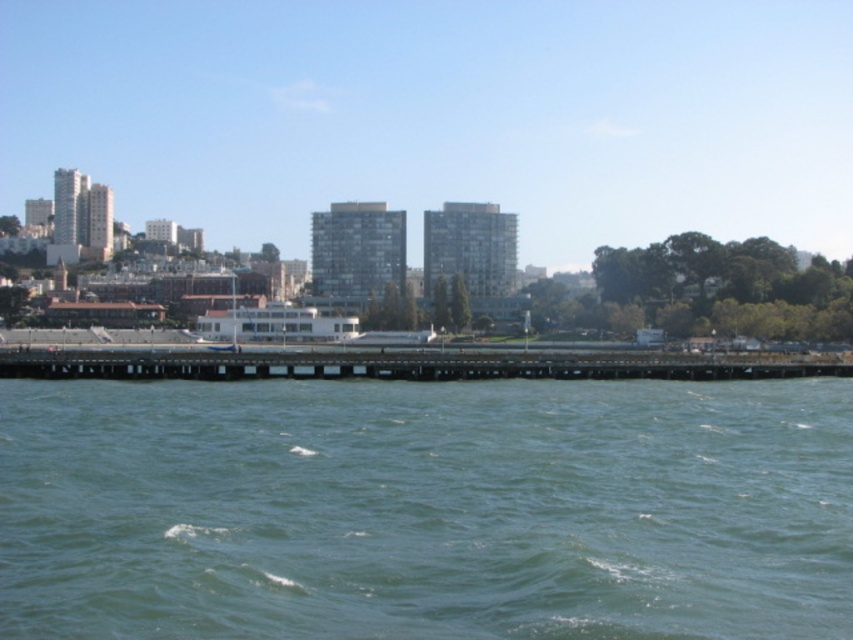
Is point (570, 609) positioned before point (531, 368)?

Yes.

Between green water at center and wooden pier at center, which one has more height?

wooden pier at center

Identify the location of green water at center. The image size is (853, 640). (426, 509).